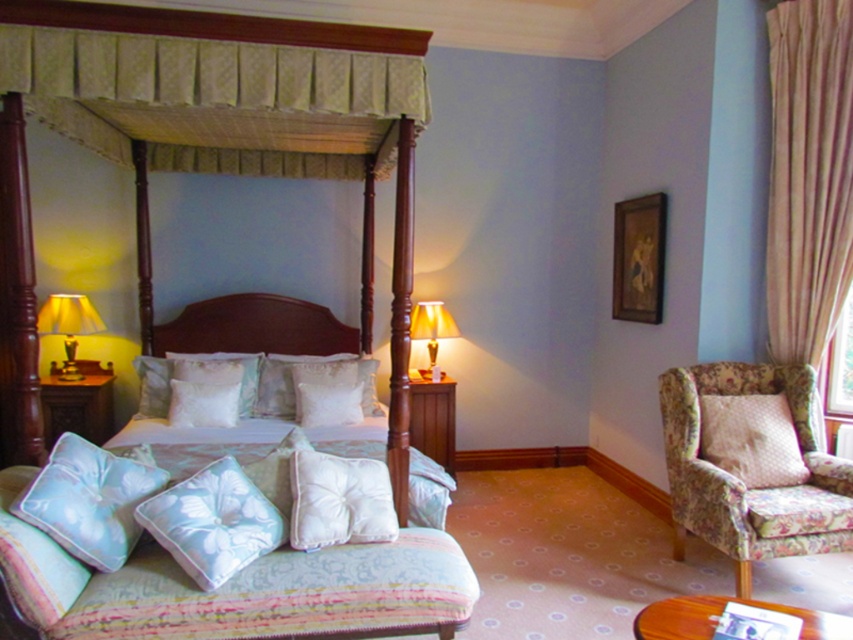
Question: Is the position of light blue fabric pillow at lower left less distant than that of matte yellow lampshade at left?

Choices:
 (A) yes
 (B) no

Answer: (A)

Question: Can you confirm if light blue satin pillow at lower left is positioned to the right of matte yellow lampshade at left?

Choices:
 (A) yes
 (B) no

Answer: (A)

Question: Can you confirm if light blue fabric cushion at lower center is positioned to the left of wooden side table at lower right?

Choices:
 (A) yes
 (B) no

Answer: (A)

Question: Which of the following is the farthest from the observer?

Choices:
 (A) light blue fabric cushion at lower center
 (B) light blue satin pillow at lower left

Answer: (A)

Question: Considering the real-world distances, which object is farthest from the matte yellow lampshade at left?

Choices:
 (A) matte gold fabric canopy bed at center
 (B) wooden side table at left

Answer: (A)

Question: Which of the following is the farthest from the observer?

Choices:
 (A) (0, 516)
 (B) (86, 460)
 (C) (720, 444)
 (D) (45, 301)

Answer: (D)